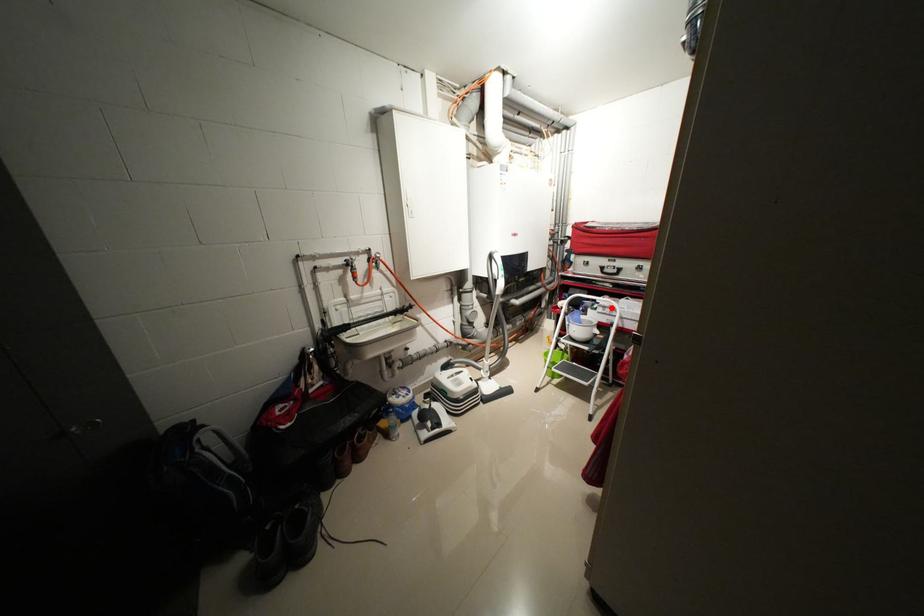
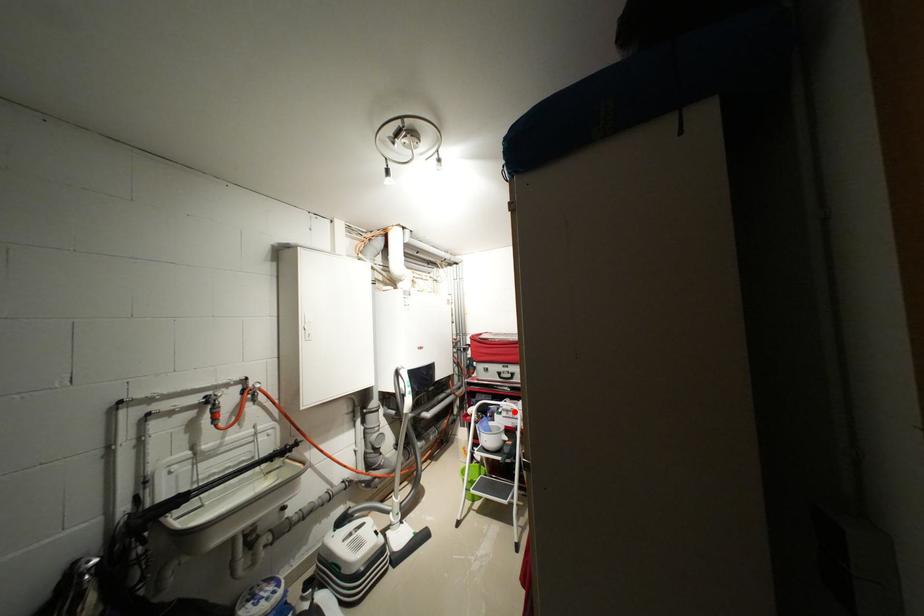
I am providing you with two images of the same scene from different viewpoints. A red point is marked on the first image and another point is marked on the second image. Do the highlighted points in image1 and image2 indicate the same real-world spot?

Yes